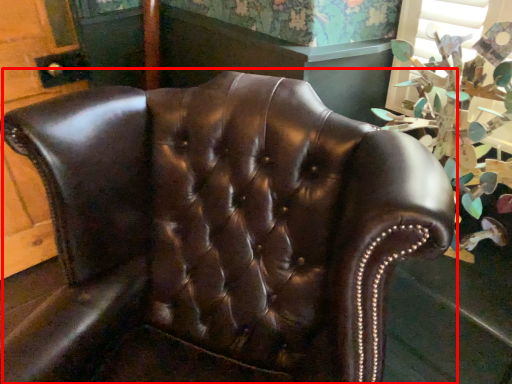
Question: Observing the image, what is the correct spatial positioning of chair (annotated by the red box) in reference to floral arrangement?

Choices:
 (A) left
 (B) right

Answer: (A)